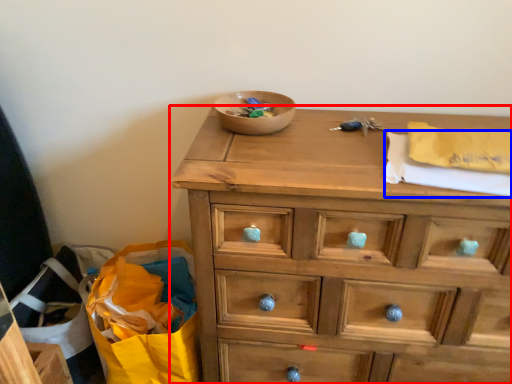
Question: Which object appears farthest to the camera in this image, chest of drawers (highlighted by a red box) or clothe (highlighted by a blue box)?

Choices:
 (A) chest of drawers
 (B) clothe

Answer: (B)